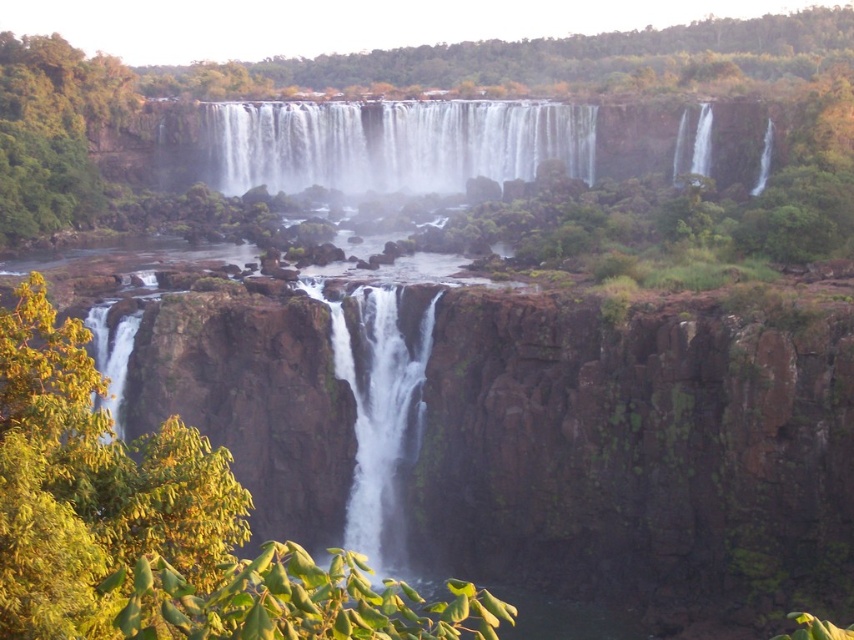
You are standing in front of the waterfall and want to take a photo. You notice the white frothy water at center and the white smooth waterfall at center. Which one is located to the right of the other?

The white frothy water at center is positioned on the right side of the white smooth waterfall at center.